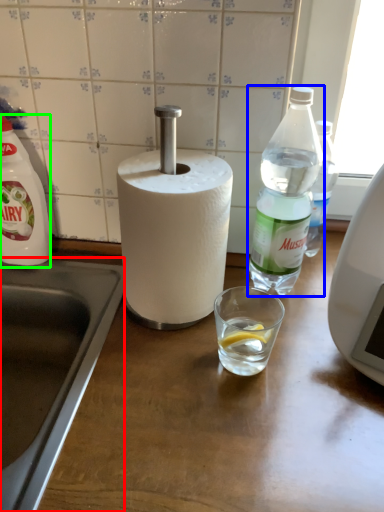
Question: Which object is the closest to the sink (highlighted by a red box)? Choose among these: bottle (highlighted by a blue box) or bottle (highlighted by a green box).

Choices:
 (A) bottle
 (B) bottle

Answer: (B)